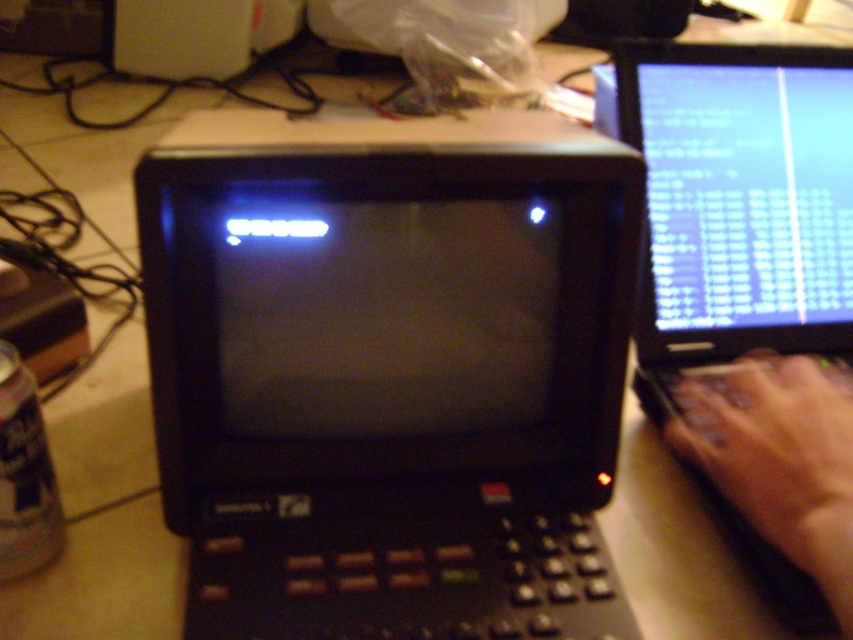
Question: Is black plastic monitor at center bigger than matte skin hand at right?

Choices:
 (A) yes
 (B) no

Answer: (A)

Question: Which object is closer to the camera taking this photo?

Choices:
 (A) matte skin hand at right
 (B) black plastic monitor at center

Answer: (A)

Question: Is black plastic monitor at center above matte skin hand at right?

Choices:
 (A) yes
 (B) no

Answer: (A)

Question: Considering the relative positions of black plastic monitor at center and matte skin hand at right in the image provided, where is black plastic monitor at center located with respect to matte skin hand at right?

Choices:
 (A) right
 (B) left

Answer: (B)